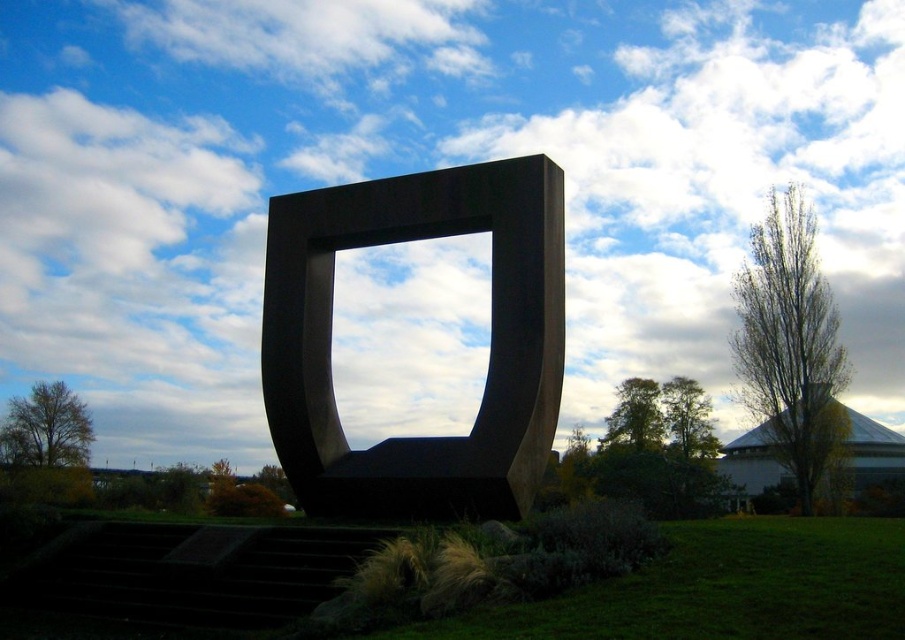
Question: Does black polished stone sculpture at center have a greater width compared to green grass at lower center?

Choices:
 (A) yes
 (B) no

Answer: (B)

Question: Is black polished stone sculpture at center further to the viewer compared to green grass at lower center?

Choices:
 (A) no
 (B) yes

Answer: (B)

Question: Which object appears farthest from the camera in this image?

Choices:
 (A) green grass at lower center
 (B) black polished stone sculpture at center

Answer: (B)

Question: Is the position of black polished stone sculpture at center less distant than that of green grass at lower center?

Choices:
 (A) no
 (B) yes

Answer: (A)

Question: Which object is farther from the camera taking this photo?

Choices:
 (A) green grass at lower center
 (B) black polished stone sculpture at center

Answer: (B)

Question: Which object is farther from the camera taking this photo?

Choices:
 (A) black polished stone sculpture at center
 (B) green grass at lower center

Answer: (A)